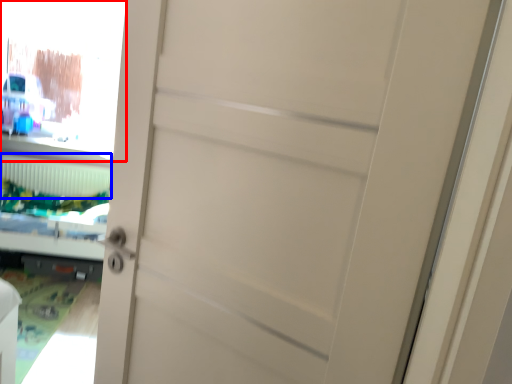
Question: Which object appears closest to the camera in this image, window screen (highlighted by a red box) or radiator (highlighted by a blue box)?

Choices:
 (A) window screen
 (B) radiator

Answer: (A)